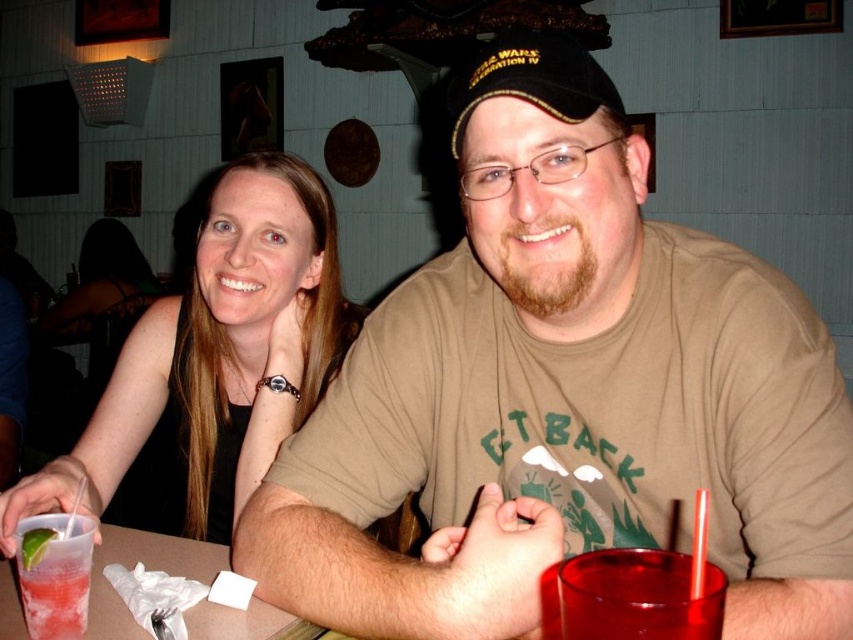
Is smooth black tank top at upper left to the left of green lime at lower left from the viewer's perspective?

Correct, you'll find smooth black tank top at upper left to the left of green lime at lower left.

Between smooth black tank top at upper left and green lime at lower left, which one appears on the left side from the viewer's perspective?

smooth black tank top at upper left

Identify the location of smooth black tank top at upper left. (213, 364).

Is smooth black tank top at upper left above clear plastic cup at lower left?

Yes.

Does point (219, 358) lie behind point (207, 563)?

That is True.

The height and width of the screenshot is (640, 853). What are the coordinates of `smooth black tank top at upper left` in the screenshot? It's located at (213, 364).

Who is positioned more to the right, smooth black tank top at upper left or transparent plastic cup at lower right?

transparent plastic cup at lower right

Looking at this image, who is taller, smooth black tank top at upper left or transparent plastic cup at lower right?

With more height is smooth black tank top at upper left.

This screenshot has height=640, width=853. Describe the element at coordinates (213, 364) in the screenshot. I see `smooth black tank top at upper left` at that location.

This screenshot has width=853, height=640. Find the location of `smooth black tank top at upper left`. smooth black tank top at upper left is located at coordinates (213, 364).